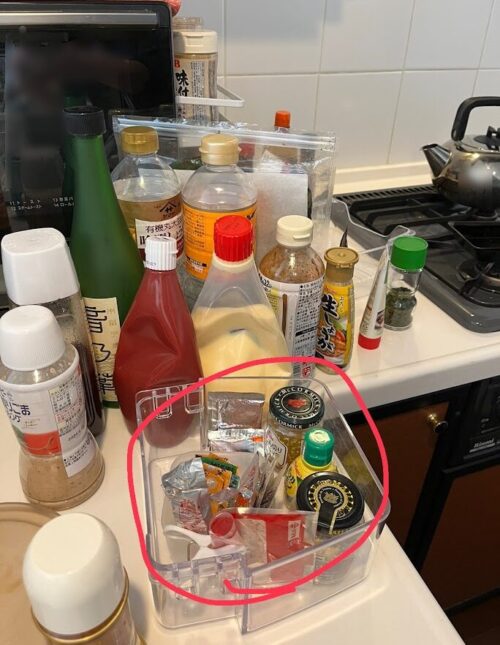
At what (x,y) coordinates should I click in order to perform the action: click on microwave. Please return your answer as a coordinate pair (x, y). Looking at the image, I should click on (144, 63).